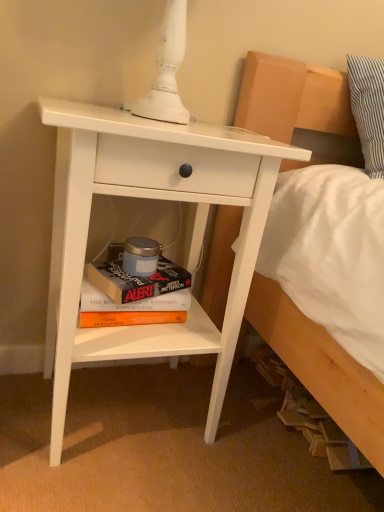
At what (x,y) coordinates should I click in order to perform the action: click on vacant area situated below white matte nightstand at center-left (from a real-world perspective). Please return your answer as a coordinate pair (x, y). The height and width of the screenshot is (512, 384). Looking at the image, I should click on (130, 404).